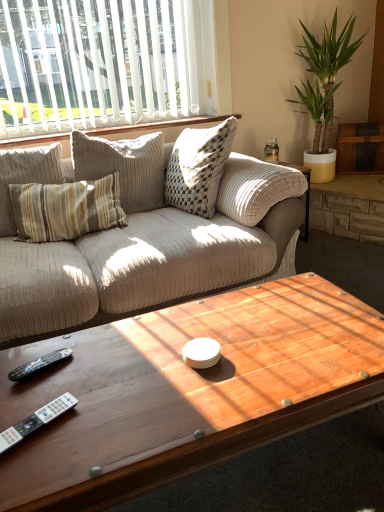
Describe the element at coordinates (187, 391) in the screenshot. This screenshot has width=384, height=512. I see `wooden coffee table at center` at that location.

Where is `white textured pillows at upper center`? white textured pillows at upper center is located at coordinates coord(156,126).

Measure the distance between point (51, 410) and camera.

Point (51, 410) is 1.01 meters away from camera.

Identify the location of wooden coffee table at center. The image size is (384, 512). (187, 391).

From the image's perspective, who appears lower, white textured pillows at upper center or green leafy plant at upper right?

white textured pillows at upper center appears lower in the image.

Looking at this image, is white textured pillows at upper center situated inside green leafy plant at upper right or outside?

white textured pillows at upper center is spatially situated outside green leafy plant at upper right.

Is point (200, 122) less distant than point (335, 55)?

That is True.

Is white textured pillows at upper center behind green leafy plant at upper right?

Yes, white textured pillows at upper center is further from the camera.

Is green leafy plant at upper right positioned far away from black plastic remote at lower left?

green leafy plant at upper right is positioned a significant distance from black plastic remote at lower left.

From the image's perspective, is green leafy plant at upper right beneath black plastic remote at lower left?

No, from the image's perspective, green leafy plant at upper right is not below black plastic remote at lower left.

Considering the sizes of objects green leafy plant at upper right and black plastic remote at lower left in the image provided, who is bigger, green leafy plant at upper right or black plastic remote at lower left?

green leafy plant at upper right is bigger.

From their relative heights in the image, would you say green leafy plant at upper right is taller or shorter than black plastic remote at lower left?

Clearly, green leafy plant at upper right is taller compared to black plastic remote at lower left.

How different are the orientations of white vertical blinds at upper left and green leafy plant at upper right in degrees?

There is a 0.517-degree angle between the facing directions of white vertical blinds at upper left and green leafy plant at upper right.

From a real-world perspective, is white vertical blinds at upper left physically above green leafy plant at upper right?

Indeed, from a real-world perspective, white vertical blinds at upper left stands above green leafy plant at upper right.

Consider the image. Does white vertical blinds at upper left touch green leafy plant at upper right?

No, white vertical blinds at upper left is not beside green leafy plant at upper right.

Would you say green leafy plant at upper right is part of white vertical blinds at upper left's contents?

No.

Is black plastic remote at lower left positioned with its back to white vertical blinds at upper left?

No, black plastic remote at lower left's orientation is not away from white vertical blinds at upper left.

Who is more distant, black plastic remote at lower left or white vertical blinds at upper left?

white vertical blinds at upper left is further away from the camera.

From a real-world perspective, which is physically below, black plastic remote at lower left or white vertical blinds at upper left?

From a 3D spatial view, black plastic remote at lower left is below.

Is black plastic remote at lower left further to the viewer compared to white plastic remote at lower left?

That is True.

Is black plastic remote at lower left thinner than white plastic remote at lower left?

Yes, black plastic remote at lower left is thinner than white plastic remote at lower left.

Does point (21, 379) appear closer or farther from the camera than point (58, 398)?

Point (21, 379) appears to be farther away from the viewer than point (58, 398).

Does black plastic remote at lower left turn towards white plastic remote at lower left?

No, black plastic remote at lower left is not facing towards white plastic remote at lower left.

From the picture: From a real-world perspective, between white plastic remote at lower left and green leafy plant at upper right, who is vertically lower?

From a 3D spatial view, white plastic remote at lower left is below.

Looking at this image, does white plastic remote at lower left come in front of green leafy plant at upper right?

Yes, white plastic remote at lower left is in front of green leafy plant at upper right.

Based on the photo, which object is positioned more to the left, white plastic remote at lower left or green leafy plant at upper right?

From the viewer's perspective, white plastic remote at lower left appears more on the left side.

Considering the relative positions of wooden coffee table at center and black plastic remote at lower left in the image provided, is wooden coffee table at center to the left of black plastic remote at lower left from the viewer's perspective?

No.

From a real-world perspective, is wooden coffee table at center positioned under black plastic remote at lower left based on gravity?

Yes.

Can you confirm if wooden coffee table at center is smaller than black plastic remote at lower left?

No.

Considering the points (255, 324) and (14, 377), which point is behind, point (255, 324) or point (14, 377)?

The point (255, 324) is farther from the camera.

Find the location of a particular element. window sill behind the green leafy plant at upper right is located at coordinates (156, 126).

Where is `remote on the left of green leafy plant at upper right`? The image size is (384, 512). remote on the left of green leafy plant at upper right is located at coordinates [39, 364].

Considering their positions, is black plastic remote at lower left positioned closer to green leafy plant at upper right than wooden coffee table at center?

wooden coffee table at center is positioned closer to the anchor green leafy plant at upper right.

From the image, which object appears to be farther from white vertical blinds at upper left, white plastic remote at lower left or wooden coffee table at center?

white plastic remote at lower left is positioned further to the anchor white vertical blinds at upper left.

Which object lies nearer to the anchor point black plastic remote at lower left, white vertical blinds at upper left or white plastic remote at lower left?

white plastic remote at lower left lies closer to black plastic remote at lower left than the other object.

Based on their spatial positions, is green leafy plant at upper right or white plastic remote at lower left further from white vertical blinds at upper left?

white plastic remote at lower left is further to white vertical blinds at upper left.

Considering their positions, is white textured pillows at upper center positioned closer to green leafy plant at upper right than white plastic remote at lower left?

white textured pillows at upper center.

In the scene shown: Looking at the image, which one is located closer to green leafy plant at upper right, white plastic remote at lower left or wooden coffee table at center?

Among the two, wooden coffee table at center is located nearer to green leafy plant at upper right.

From the image, which object appears to be farther from black plastic remote at lower left, white plastic remote at lower left or white textured pillows at upper center?

white textured pillows at upper center.

Considering their positions, is white plastic remote at lower left positioned closer to white textured pillows at upper center than wooden coffee table at center?

wooden coffee table at center lies closer to white textured pillows at upper center than the other object.

Image resolution: width=384 pixels, height=512 pixels. Identify the location of window sill that lies between white vertical blinds at upper left and black plastic remote at lower left from top to bottom. (156, 126).

The width and height of the screenshot is (384, 512). I want to click on remote between white vertical blinds at upper left and white plastic remote at lower left in the up-down direction, so click(39, 364).

Find the location of a particular element. remote between white plastic remote at lower left and white textured pillows at upper center from front to back is located at coordinates (39, 364).

Find the location of `remote between wooden coffee table at center and white textured pillows at upper center in the front-back direction`. remote between wooden coffee table at center and white textured pillows at upper center in the front-back direction is located at coordinates (39, 364).